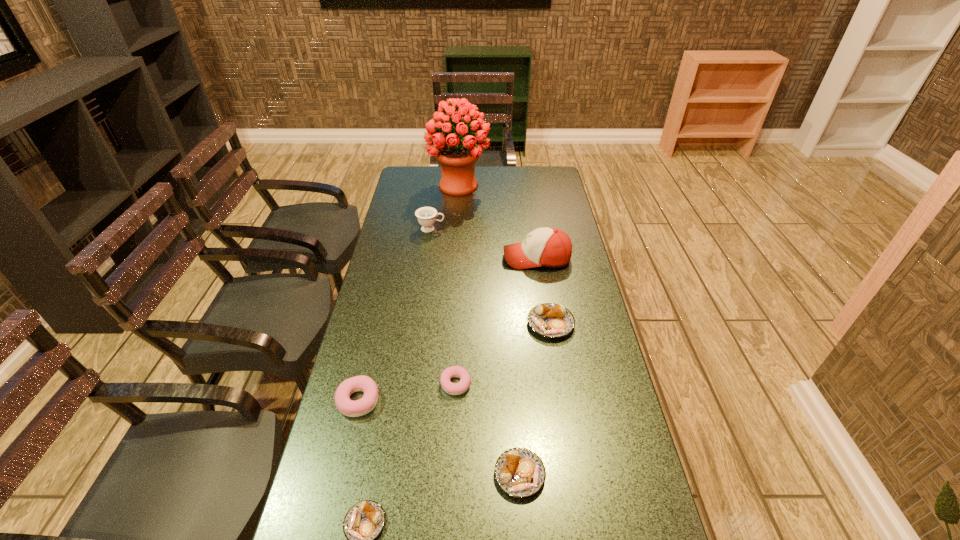
Locate an element on the screen. The width and height of the screenshot is (960, 540). bouquet is located at coordinates (457, 158).

This screenshot has width=960, height=540. In order to click on the farthest object in this screenshot , I will do `click(457, 158)`.

The width and height of the screenshot is (960, 540). Identify the location of orange baseball cap. (549, 247).

You are a GUI agent. You are given a task and a screenshot of the screen. Output one action in this format:
    pyautogui.click(x=<x>, y=<y>)
    Task: Click on the baseball cap
    The image size is (960, 540).
    Given the screenshot: What is the action you would take?
    pyautogui.click(x=549, y=247)

I want to click on blue teacup, so click(426, 216).

What are the coordinates of `teacup` in the screenshot? It's located at (426, 216).

The width and height of the screenshot is (960, 540). Find the location of `the farthest brown pastry`. the farthest brown pastry is located at coordinates (549, 320).

The image size is (960, 540). What are the coordinates of `the farthest pastry` in the screenshot? It's located at (549, 320).

Image resolution: width=960 pixels, height=540 pixels. I want to click on the left pink pastry, so [367, 403].

Where is `the fourth farthest pastry`? The image size is (960, 540). the fourth farthest pastry is located at coordinates (519, 472).